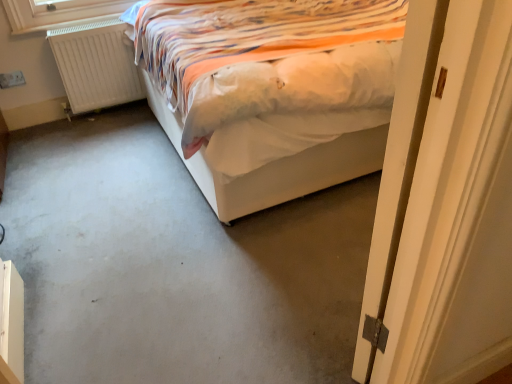
Question: Can we say white wooden door at right lies outside white matte radiator at left?

Choices:
 (A) no
 (B) yes

Answer: (B)

Question: From the image's perspective, does white wooden door at right appear higher than white matte radiator at left?

Choices:
 (A) yes
 (B) no

Answer: (B)

Question: Could you tell me if white wooden door at right is facing white matte radiator at left?

Choices:
 (A) no
 (B) yes

Answer: (B)

Question: Does white wooden door at right appear on the left side of white matte radiator at left?

Choices:
 (A) no
 (B) yes

Answer: (A)

Question: Is white wooden door at right thinner than white matte radiator at left?

Choices:
 (A) yes
 (B) no

Answer: (B)

Question: In terms of size, does gray carpet at center appear bigger or smaller than white fabric bed at center?

Choices:
 (A) big
 (B) small

Answer: (B)

Question: Looking at their shapes, would you say gray carpet at center is wider or thinner than white fabric bed at center?

Choices:
 (A) wide
 (B) thin

Answer: (A)

Question: In the image, is gray carpet at center positioned in front of or behind white fabric bed at center?

Choices:
 (A) front
 (B) behind

Answer: (A)

Question: From a real-world perspective, is gray carpet at center positioned above or below white fabric bed at center?

Choices:
 (A) above
 (B) below

Answer: (B)

Question: From the image's perspective, is white wooden door at right positioned above or below gray carpet at center?

Choices:
 (A) below
 (B) above

Answer: (B)

Question: From a real-world perspective, is white wooden door at right above or below gray carpet at center?

Choices:
 (A) above
 (B) below

Answer: (A)

Question: Is point (382, 235) closer or farther from the camera than point (227, 266)?

Choices:
 (A) closer
 (B) farther

Answer: (A)

Question: Considering the positions of white wooden door at right and gray carpet at center in the image, is white wooden door at right taller or shorter than gray carpet at center?

Choices:
 (A) tall
 (B) short

Answer: (A)

Question: Is point (400, 269) closer or farther from the camera than point (133, 59)?

Choices:
 (A) closer
 (B) farther

Answer: (A)

Question: From a real-world perspective, is white wooden door at right physically located above or below white matte radiator at left?

Choices:
 (A) below
 (B) above

Answer: (B)